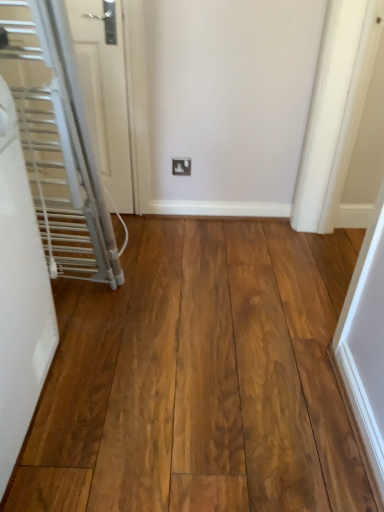
From the picture: Measure the distance between white matte radiator at left, arranged as the 2th door when viewed from the back, and camera.

white matte radiator at left, arranged as the 2th door when viewed from the back, and camera are 87.38 centimeters apart.

The height and width of the screenshot is (512, 384). Describe the element at coordinates (181, 166) in the screenshot. I see `white plastic outlet at center` at that location.

The image size is (384, 512). Describe the element at coordinates (199, 378) in the screenshot. I see `natural wood flooring at center` at that location.

Measure the distance between natural wood flooring at center and camera.

A distance of 98.23 centimeters exists between natural wood flooring at center and camera.

You are a GUI agent. You are given a task and a screenshot of the screen. Output one action in this format:
    pyautogui.click(x=<x>, y=<y>)
    Task: Click on the white matte radiator at left, which appears as the 1th door when viewed from the front
    
    Given the screenshot: What is the action you would take?
    pyautogui.click(x=20, y=297)

From the picture: How distant is white matte radiator at left, which appears as the 1th door when viewed from the front, from natural wood flooring at center?

white matte radiator at left, which appears as the 1th door when viewed from the front, is 41.93 centimeters away from natural wood flooring at center.

Is natural wood flooring at center surrounded by white matte radiator at left, which appears as the 1th door when viewed from the front?

No, natural wood flooring at center is not surrounded by white matte radiator at left, which appears as the 1th door when viewed from the front.

Which point is more forward, (10, 367) or (198, 359)?

The point (10, 367) is closer.

From a real-world perspective, is white matte radiator at left, arranged as the 2th door when viewed from the back, positioned above or below natural wood flooring at center?

white matte radiator at left, arranged as the 2th door when viewed from the back, is situated higher than natural wood flooring at center in the real world.

From a real-world perspective, between natural wood flooring at center and white matte radiator at left, arranged as the 2th door when viewed from the back, who is vertically higher?

white matte radiator at left, arranged as the 2th door when viewed from the back.

Which object is thinner, natural wood flooring at center or white matte radiator at left, arranged as the 2th door when viewed from the back?

With smaller width is white matte radiator at left, arranged as the 2th door when viewed from the back.

Considering the sizes of objects natural wood flooring at center and white matte radiator at left, arranged as the 2th door when viewed from the back, in the image provided, who is shorter, natural wood flooring at center or white matte radiator at left, arranged as the 2th door when viewed from the back,?

natural wood flooring at center.

Who is smaller, white plastic outlet at center or natural wood flooring at center?

white plastic outlet at center.

From a real-world perspective, which is physically above, white plastic outlet at center or natural wood flooring at center?

white plastic outlet at center is physically above.

Does white plastic outlet at center turn towards natural wood flooring at center?

Yes, white plastic outlet at center is facing natural wood flooring at center.

Which is in front, white plastic outlet at center or natural wood flooring at center?

natural wood flooring at center is in front.

Which of these two, white matte radiator at left, which appears as the 1th door when viewed from the front, or white glossy door at left, arranged as the second door when viewed from the front, is wider?

white matte radiator at left, which appears as the 1th door when viewed from the front.

Is point (9, 444) less distant than point (87, 192)?

Yes.

Who is shorter, white matte radiator at left, arranged as the 2th door when viewed from the back, or white glossy door at left, arranged as the second door when viewed from the front?

white matte radiator at left, arranged as the 2th door when viewed from the back.

In the scene shown: From the image's perspective, between white matte radiator at left, arranged as the 2th door when viewed from the back, and white glossy door at left, arranged as the second door when viewed from the front, which one is located above?

white glossy door at left, arranged as the second door when viewed from the front, appears higher in the image.

Consider the image. Which is in front, natural wood flooring at center or white glossy door at left, placed as the 1th door when sorted from back to front?

natural wood flooring at center is in front.

Considering the relative sizes of natural wood flooring at center and white glossy door at left, placed as the 1th door when sorted from back to front, in the image provided, is natural wood flooring at center smaller than white glossy door at left, placed as the 1th door when sorted from back to front,?

No, natural wood flooring at center is not smaller than white glossy door at left, placed as the 1th door when sorted from back to front.

How many degrees apart are the facing directions of natural wood flooring at center and white glossy door at left, placed as the 1th door when sorted from back to front?

natural wood flooring at center and white glossy door at left, placed as the 1th door when sorted from back to front, are facing 90 degrees away from each other.

Locate an element on the screen. The width and height of the screenshot is (384, 512). hardwood below the white glossy door at left, arranged as the second door when viewed from the front (from the image's perspective) is located at coordinates (199, 378).

How distant is white glossy door at left, placed as the 1th door when sorted from back to front, from natural wood flooring at center?

white glossy door at left, placed as the 1th door when sorted from back to front, is 20.47 inches away from natural wood flooring at center.

From the image's perspective, would you say white glossy door at left, arranged as the second door when viewed from the front, is shown under natural wood flooring at center?

No.

Is white glossy door at left, arranged as the second door when viewed from the front, far from natural wood flooring at center?

No.

Considering the relative sizes of white plastic outlet at center and white matte radiator at left, arranged as the 2th door when viewed from the back, in the image provided, is white plastic outlet at center smaller than white matte radiator at left, arranged as the 2th door when viewed from the back,?

Yes.

Is white plastic outlet at center to the right of white matte radiator at left, arranged as the 2th door when viewed from the back, from the viewer's perspective?

Yes.

Which object is further away from the camera, white plastic outlet at center or white matte radiator at left, arranged as the 2th door when viewed from the back?

white plastic outlet at center is further from the camera.

From a real-world perspective, which is physically below, white plastic outlet at center or white matte radiator at left, arranged as the 2th door when viewed from the back?

white plastic outlet at center is physically lower.

Image resolution: width=384 pixels, height=512 pixels. There is a natural wood flooring at center. Find the location of `the 1st door above it (from a real-world perspective)`. the 1st door above it (from a real-world perspective) is located at coordinates (20, 297).

Where is `door that is the 2nd one when counting leftward from the natural wood flooring at center`? This screenshot has width=384, height=512. door that is the 2nd one when counting leftward from the natural wood flooring at center is located at coordinates (x=20, y=297).

Estimate the real-world distances between objects in this image. Which object is further from white plastic outlet at center, white matte radiator at left, arranged as the 2th door when viewed from the back, or natural wood flooring at center?

Among the two, white matte radiator at left, arranged as the 2th door when viewed from the back, is located further to white plastic outlet at center.

Based on their spatial positions, is white matte radiator at left, arranged as the 2th door when viewed from the back, or white plastic outlet at center further from white glossy door at left, placed as the 1th door when sorted from back to front?

Based on the image, white plastic outlet at center appears to be further to white glossy door at left, placed as the 1th door when sorted from back to front.

When comparing their distances from natural wood flooring at center, does white glossy door at left, arranged as the second door when viewed from the front, or white matte radiator at left, arranged as the 2th door when viewed from the back, seem closer?

Among the two, white matte radiator at left, arranged as the 2th door when viewed from the back, is located nearer to natural wood flooring at center.

Based on their spatial positions, is white glossy door at left, placed as the 1th door when sorted from back to front, or natural wood flooring at center closer to white plastic outlet at center?

white glossy door at left, placed as the 1th door when sorted from back to front, is positioned closer to the anchor white plastic outlet at center.

From the image, which object appears to be nearer to white plastic outlet at center, natural wood flooring at center or white glossy door at left, placed as the 1th door when sorted from back to front?

white glossy door at left, placed as the 1th door when sorted from back to front, is closer to white plastic outlet at center.

Estimate the real-world distances between objects in this image. Which object is closer to white plastic outlet at center, natural wood flooring at center or white matte radiator at left, which appears as the 1th door when viewed from the front?

natural wood flooring at center is positioned closer to the anchor white plastic outlet at center.

Estimate the real-world distances between objects in this image. Which object is closer to white matte radiator at left, which appears as the 1th door when viewed from the front, natural wood flooring at center or white plastic outlet at center?

Among the two, natural wood flooring at center is located nearer to white matte radiator at left, which appears as the 1th door when viewed from the front.

Considering their positions, is white glossy door at left, arranged as the second door when viewed from the front, positioned closer to white matte radiator at left, arranged as the 2th door when viewed from the back, than white plastic outlet at center?

white glossy door at left, arranged as the second door when viewed from the front.

The height and width of the screenshot is (512, 384). In order to click on door between white matte radiator at left, which appears as the 1th door when viewed from the front, and white plastic outlet at center, along the z-axis in this screenshot , I will do `click(57, 142)`.

This screenshot has height=512, width=384. What are the coordinates of `hardwood located between white matte radiator at left, arranged as the 2th door when viewed from the back, and white plastic outlet at center in the depth direction` in the screenshot? It's located at (199, 378).

At what (x,y) coordinates should I click in order to perform the action: click on hardwood between white matte radiator at left, which appears as the 1th door when viewed from the front, and white glossy door at left, placed as the 1th door when sorted from back to front, along the z-axis. Please return your answer as a coordinate pair (x, y). The height and width of the screenshot is (512, 384). Looking at the image, I should click on (199, 378).

Identify the location of door positioned between natural wood flooring at center and white plastic outlet at center from near to far. (57, 142).